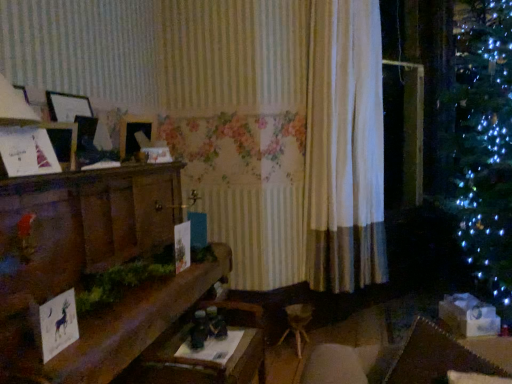
Question: Can you confirm if wooden table at center is positioned to the left of white paper card at lower left, the 2th christmas card in the left-to-right sequence?

Choices:
 (A) yes
 (B) no

Answer: (B)

Question: From the image's perspective, is wooden table at center under white paper card at lower left, the 1th christmas card positioned from the bottom?

Choices:
 (A) yes
 (B) no

Answer: (A)

Question: Can you confirm if wooden table at center is thinner than white paper card at lower left, the first christmas card in the front-to-back sequence?

Choices:
 (A) yes
 (B) no

Answer: (B)

Question: From a real-world perspective, is wooden table at center over white paper card at lower left, the first christmas card in the front-to-back sequence?

Choices:
 (A) yes
 (B) no

Answer: (B)

Question: Is white paper card at lower left, the first christmas card in the front-to-back sequence, at the back of wooden table at center?

Choices:
 (A) no
 (B) yes

Answer: (A)

Question: From a real-world perspective, is wooden table at center physically below white paper card at lower left, the 1th christmas card positioned from the bottom?

Choices:
 (A) no
 (B) yes

Answer: (B)

Question: Is wooden mantelpiece at left completely or partially outside of white fabric curtain at center?

Choices:
 (A) yes
 (B) no

Answer: (A)

Question: Considering the relative sizes of wooden mantelpiece at left and white fabric curtain at center in the image provided, is wooden mantelpiece at left shorter than white fabric curtain at center?

Choices:
 (A) no
 (B) yes

Answer: (B)

Question: Is wooden mantelpiece at left further to the viewer compared to white fabric curtain at center?

Choices:
 (A) yes
 (B) no

Answer: (B)

Question: From the image's perspective, would you say wooden mantelpiece at left is shown under white fabric curtain at center?

Choices:
 (A) no
 (B) yes

Answer: (B)

Question: Is wooden mantelpiece at left far away from white fabric curtain at center?

Choices:
 (A) no
 (B) yes

Answer: (B)

Question: Can you confirm if wooden mantelpiece at left is smaller than white fabric curtain at center?

Choices:
 (A) no
 (B) yes

Answer: (A)

Question: Is white paper christmas card at left, the first christmas card from the top, to the right of white paper card at lower left, the 2th christmas card in the left-to-right sequence, from the viewer's perspective?

Choices:
 (A) yes
 (B) no

Answer: (B)